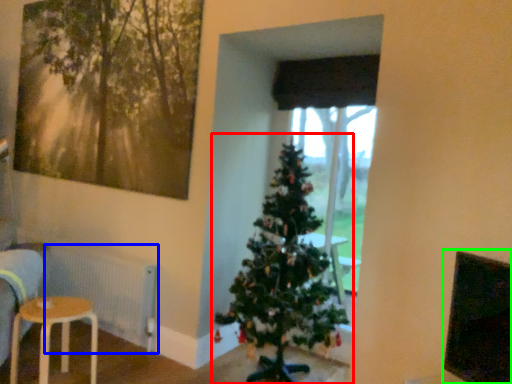
Question: Which is nearer to the christmas tree (highlighted by a red box)? radiator (highlighted by a blue box) or window screen (highlighted by a green box).

Choices:
 (A) radiator
 (B) window screen

Answer: (A)